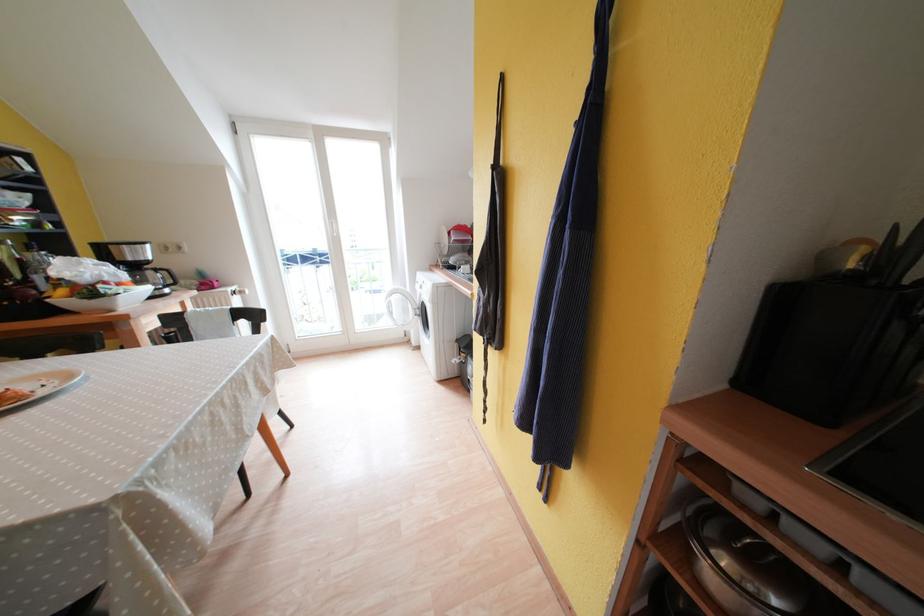
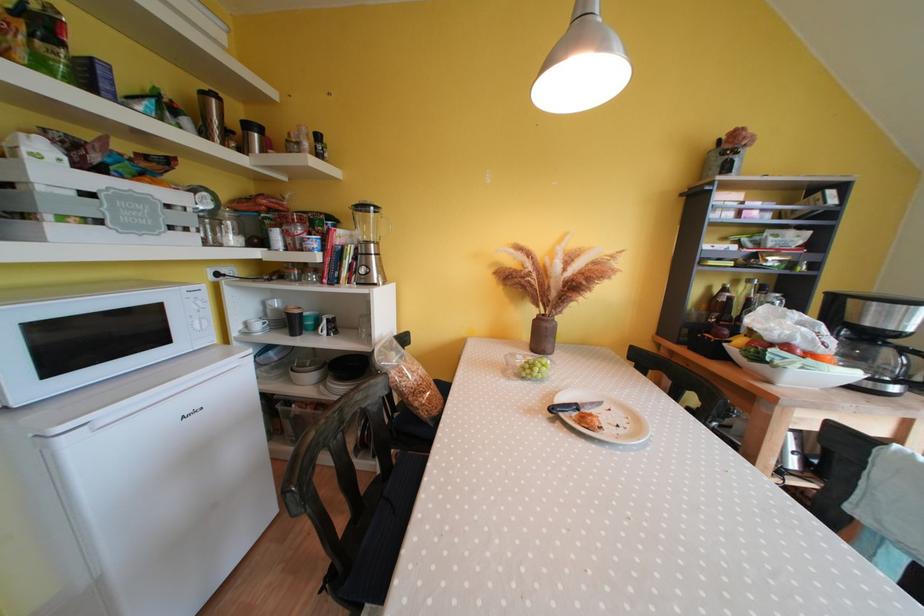
The point at (154, 293) is marked in the first image. Where is the corresponding point in the second image?

(858, 378)